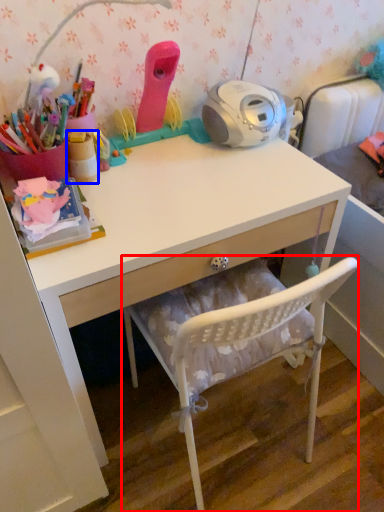
Question: Which of the following is the farthest to the observer, chair (highlighted by a red box) or stationery (highlighted by a blue box)?

Choices:
 (A) chair
 (B) stationery

Answer: (B)